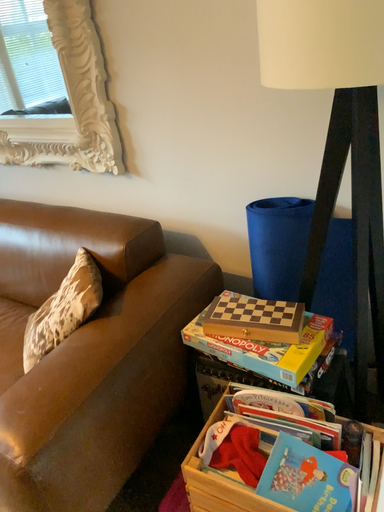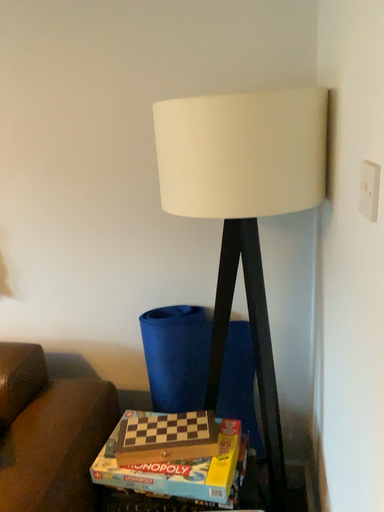
Question: How did the camera likely rotate when shooting the video?

Choices:
 (A) rotated upward
 (B) rotated downward

Answer: (A)